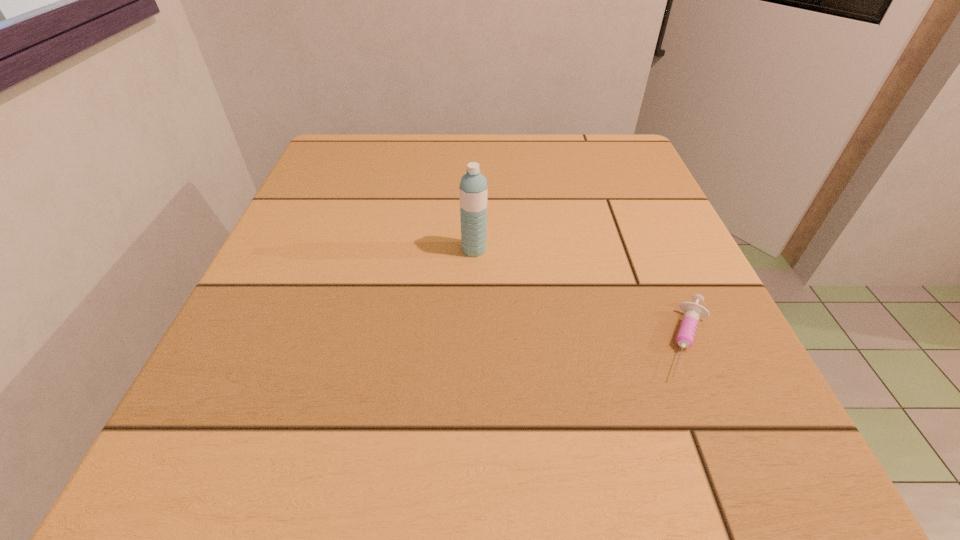
Identify the location of water bottle. (473, 187).

Locate an element on the screen. the left object is located at coordinates (473, 187).

You are a GUI agent. You are given a task and a screenshot of the screen. Output one action in this format:
    pyautogui.click(x=<x>, y=<y>)
    Task: Click on the nearer object
    
    Given the screenshot: What is the action you would take?
    pyautogui.click(x=693, y=312)

Locate an element on the screen. The height and width of the screenshot is (540, 960). the shorter object is located at coordinates (693, 312).

Where is `vacant region located 0.250m on the left of the farther object`? vacant region located 0.250m on the left of the farther object is located at coordinates (318, 249).

In order to click on free space located 0.390m on the left of the nearer object in this screenshot , I will do `click(379, 340)`.

Locate an element on the screen. The image size is (960, 540). object positioned at the right edge is located at coordinates (693, 312).

Where is `blank space at the far edge of the desktop`? This screenshot has height=540, width=960. blank space at the far edge of the desktop is located at coordinates (411, 159).

Locate an element on the screen. The width and height of the screenshot is (960, 540). vacant space at the near edge is located at coordinates (414, 478).

This screenshot has width=960, height=540. In the image, there is a desktop. In order to click on vacant area at the left edge in this screenshot , I will do `click(238, 354)`.